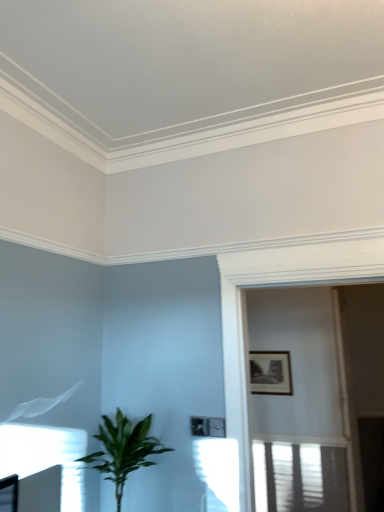
This screenshot has height=512, width=384. What do you see at coordinates (270, 373) in the screenshot?
I see `black matte picture frame at upper right` at bounding box center [270, 373].

In order to click on black matte picture frame at upper right in this screenshot , I will do `click(270, 373)`.

Who is bigger, green leafy plant at lower left or white glossy screen door at upper center?

With larger size is white glossy screen door at upper center.

Would you say green leafy plant at lower left is outside white glossy screen door at upper center?

Yes, green leafy plant at lower left is not within white glossy screen door at upper center.

Are green leafy plant at lower left and white glossy screen door at upper center located far from each other?

Indeed, green leafy plant at lower left is not near white glossy screen door at upper center.

From the image's perspective, which is above, green leafy plant at lower left or white glossy screen door at upper center?

white glossy screen door at upper center.

From the image's perspective, is black matte picture frame at upper right over white glossy screen door at upper center?

Actually, black matte picture frame at upper right appears below white glossy screen door at upper center in the image.

Is black matte picture frame at upper right in front of or behind white glossy screen door at upper center in the image?

In the image, black matte picture frame at upper right appears behind white glossy screen door at upper center.

Between black matte picture frame at upper right and white glossy screen door at upper center, which one has smaller width?

black matte picture frame at upper right.

Can white glossy screen door at upper center be found inside black matte picture frame at upper right?

No.

Which is more to the right, white glossy screen door at upper center or green leafy plant at lower left?

From the viewer's perspective, white glossy screen door at upper center appears more on the right side.

Between white glossy screen door at upper center and green leafy plant at lower left, which one has smaller size?

With smaller size is green leafy plant at lower left.

In the scene shown: Is white glossy screen door at upper center facing away from green leafy plant at lower left?

No, white glossy screen door at upper center's orientation is not away from green leafy plant at lower left.

Which object is more forward, white glossy screen door at upper center or green leafy plant at lower left?

green leafy plant at lower left is in front.

Considering the relative sizes of green leafy plant at lower left and black matte picture frame at upper right in the image provided, is green leafy plant at lower left shorter than black matte picture frame at upper right?

In fact, green leafy plant at lower left may be taller than black matte picture frame at upper right.

Is point (123, 481) positioned in front of point (265, 383)?

Yes, it is in front of point (265, 383).

Can you tell me how much green leafy plant at lower left and black matte picture frame at upper right differ in facing direction?

The facing directions of green leafy plant at lower left and black matte picture frame at upper right are 91.1 degrees apart.

Does black matte picture frame at upper right have a lesser width compared to green leafy plant at lower left?

Correct, the width of black matte picture frame at upper right is less than that of green leafy plant at lower left.

Does point (250, 379) come farther from viewer compared to point (103, 432)?

Yes, point (250, 379) is behind point (103, 432).

In the scene shown: From a real-world perspective, is black matte picture frame at upper right positioned above or below green leafy plant at lower left?

Clearly, from a real-world perspective, black matte picture frame at upper right is above green leafy plant at lower left.

Is white glossy screen door at upper center taller or shorter than black matte picture frame at upper right?

In the image, white glossy screen door at upper center appears to be taller than black matte picture frame at upper right.

Consider the image. Is white glossy screen door at upper center oriented towards black matte picture frame at upper right?

No, white glossy screen door at upper center is not oriented towards black matte picture frame at upper right.

Considering the positions of point (258, 447) and point (252, 392), is point (258, 447) closer or farther from the camera than point (252, 392)?

Point (258, 447) is positioned closer to the camera compared to point (252, 392).

At what (x,y) coordinates should I click in order to perform the action: click on screen door lying in front of the black matte picture frame at upper right. Please return your answer as a coordinate pair (x, y). Image resolution: width=384 pixels, height=512 pixels. Looking at the image, I should click on (302, 404).

In order to click on screen door above the green leafy plant at lower left (from the image's perspective) in this screenshot , I will do `click(302, 404)`.

The width and height of the screenshot is (384, 512). I want to click on screen door positioned vertically above the black matte picture frame at upper right (from a real-world perspective), so click(302, 404).

Looking at this image, which object lies further to the anchor point white glossy screen door at upper center, black matte picture frame at upper right or green leafy plant at lower left?

green leafy plant at lower left is positioned further to the anchor white glossy screen door at upper center.

When comparing their distances from white glossy screen door at upper center, does green leafy plant at lower left or black matte picture frame at upper right seem further?

The object further to white glossy screen door at upper center is green leafy plant at lower left.

Which object lies further to the anchor point green leafy plant at lower left, white glossy screen door at upper center or black matte picture frame at upper right?

Based on the image, white glossy screen door at upper center appears to be further to green leafy plant at lower left.

Looking at the image, which one is located further to black matte picture frame at upper right, green leafy plant at lower left or white glossy screen door at upper center?

The object further to black matte picture frame at upper right is green leafy plant at lower left.

From the image, which object appears to be nearer to black matte picture frame at upper right, white glossy screen door at upper center or green leafy plant at lower left?

white glossy screen door at upper center.

When comparing their distances from green leafy plant at lower left, does black matte picture frame at upper right or white glossy screen door at upper center seem further?

white glossy screen door at upper center.

What are the coordinates of `screen door located between green leafy plant at lower left and black matte picture frame at upper right in the depth direction` in the screenshot? It's located at (302, 404).